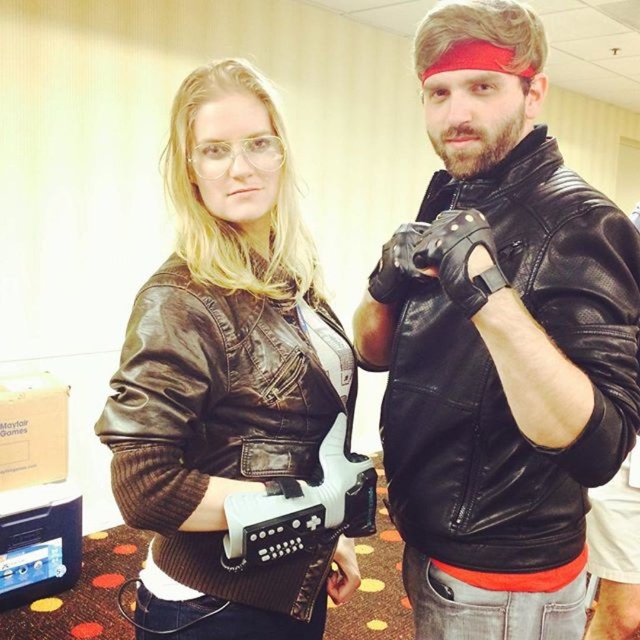
Does black leather jacket at center have a smaller size compared to brown leather jacket at center?

No.

Between point (637, 401) and point (164, 324), which one is positioned behind?

Positioned behind is point (164, 324).

Locate an element on the screen. black leather jacket at center is located at coordinates (500, 344).